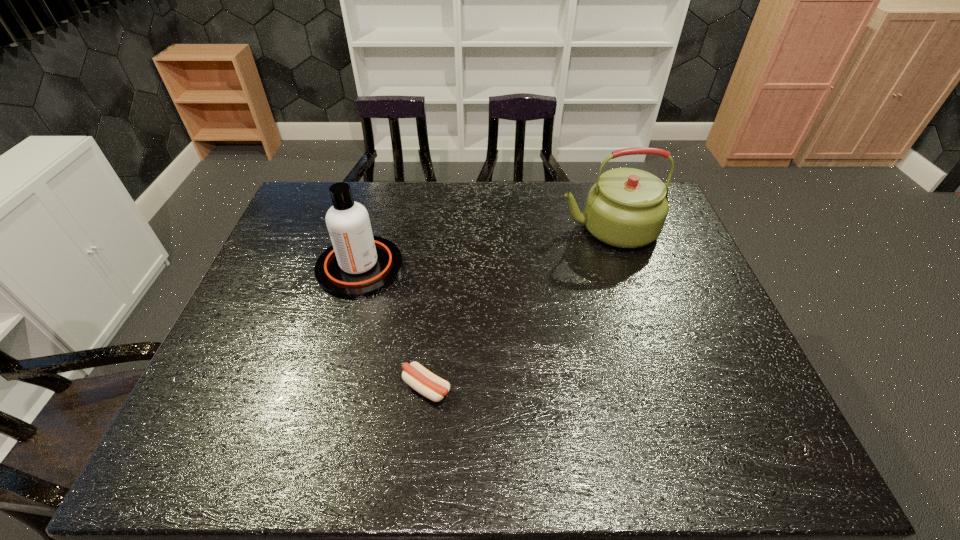
Locate an element on the screen. The height and width of the screenshot is (540, 960). free location that satisfies the following two spatial constraints: 1. at the spout of the rightmost object; 2. on the front side of the sausage is located at coordinates (661, 388).

Locate an element on the screen. vacant space that satisfies the following two spatial constraints: 1. at the spout of the kettle; 2. on the front side of the nearest object is located at coordinates [661, 388].

The height and width of the screenshot is (540, 960). In order to click on free spot that satisfies the following two spatial constraints: 1. at the spout of the kettle; 2. on the front side of the sausage in this screenshot , I will do `click(661, 388)`.